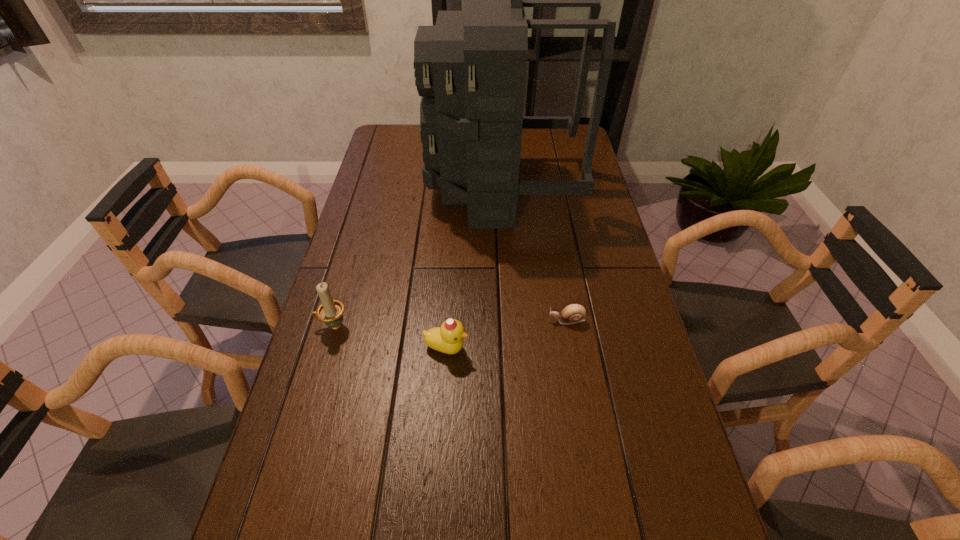
Where is `vacant space that's between the candle_holder and the second shortest object`? This screenshot has height=540, width=960. vacant space that's between the candle_holder and the second shortest object is located at coordinates (390, 337).

The height and width of the screenshot is (540, 960). Identify the location of free point between the backpack and the leftmost object. (418, 258).

Where is `vacant area between the escargot and the tallest object`? The height and width of the screenshot is (540, 960). vacant area between the escargot and the tallest object is located at coordinates (535, 255).

Find the location of a particular element. This screenshot has height=540, width=960. the third closest object to the shortest object is located at coordinates (331, 311).

Identify which object is the third nearest to the third tallest object. Please provide its 2D coordinates. Your answer should be formatted as a tuple, i.e. [(x, y)], where the tuple contains the x and y coordinates of a point satisfying the conditions above.

[(470, 68)]